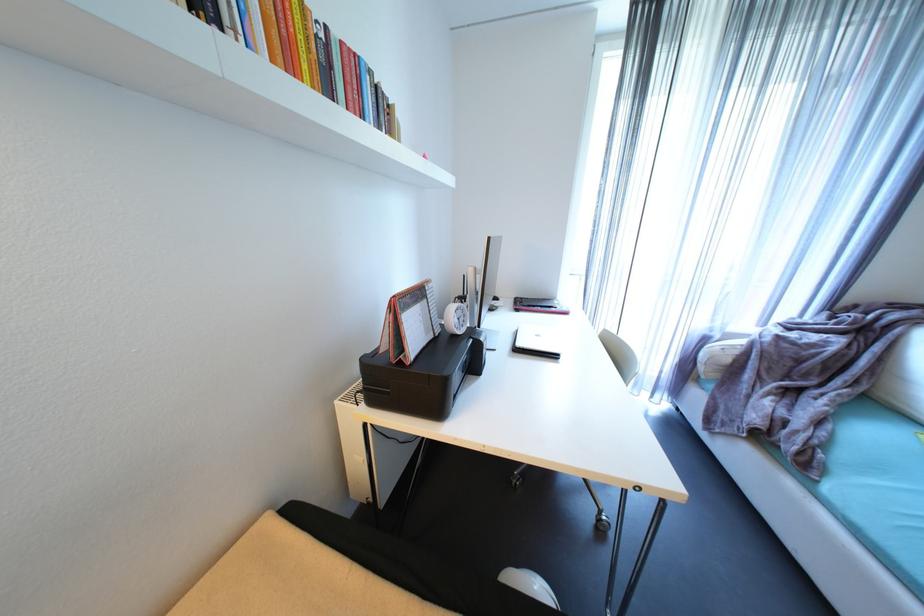
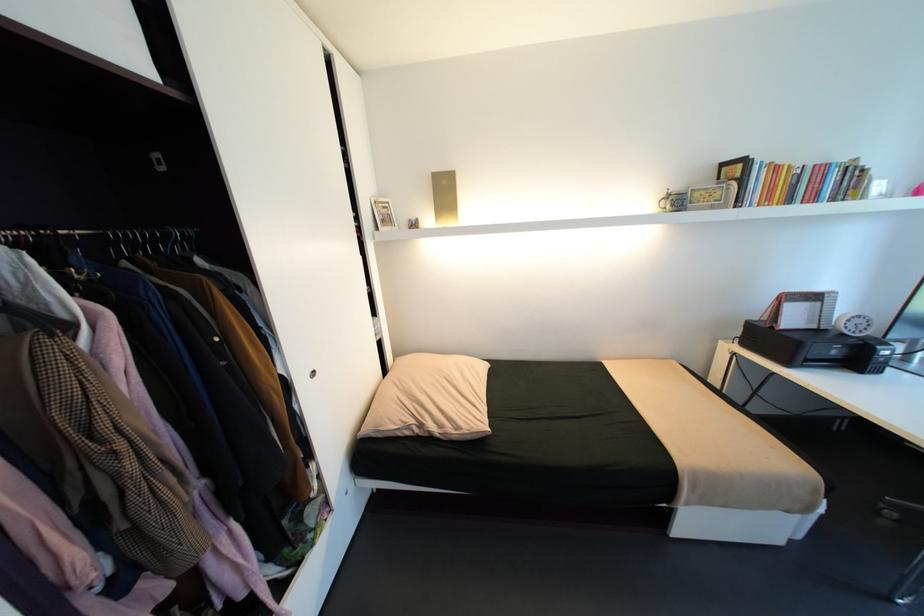
The point at (347,42) is marked in the first image. Where is the corresponding point in the second image?

(821, 166)